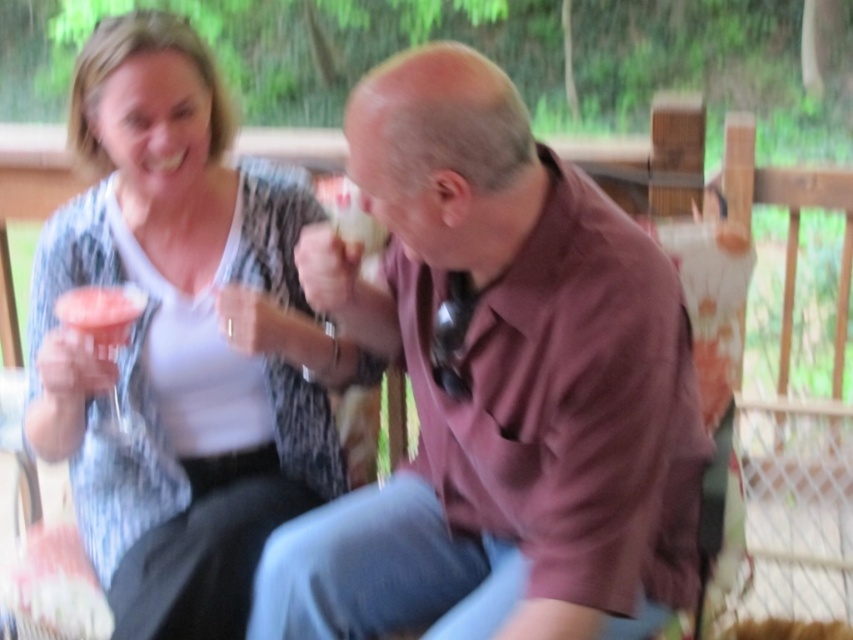
You are designing a layout for a magazine spread and need to place two clothing items side by side. The brown matte shirt at center and the matte white blouse at upper left must be positioned so that their heights are proportional to their actual sizes in the image. Which clothing item should you place higher on the page to maintain the correct proportion?

The brown matte shirt at center is shorter than the matte white blouse at upper left, so to maintain the correct proportion, the brown matte shirt at center should be placed lower on the page and the matte white blouse at upper left should be placed higher since it is taller.

You are a photographer trying to capture a candid shot of both the brown matte shirt at center and the matte white blouse at upper left. Since you want to ensure both are fully visible in the frame, which object should you position closer to the camera to avoid obstruction?

The brown matte shirt at center is in front of the matte white blouse at upper left, so positioning the brown matte shirt at center closer to the camera would ensure both are visible without obstruction.

You are a photographer trying to capture a candid shot of the two people in the scene. You want to ensure that both the brown matte shirt at center and the matte white blouse at upper left are clearly visible in the frame. Based on their positions, which direction should you position your camera relative to the subjects to best include both in the shot?

Since the brown matte shirt at center is located below the matte white blouse at upper left, positioning the camera above the subjects would allow both the brown matte shirt at center and the matte white blouse at upper left to be in clear view.